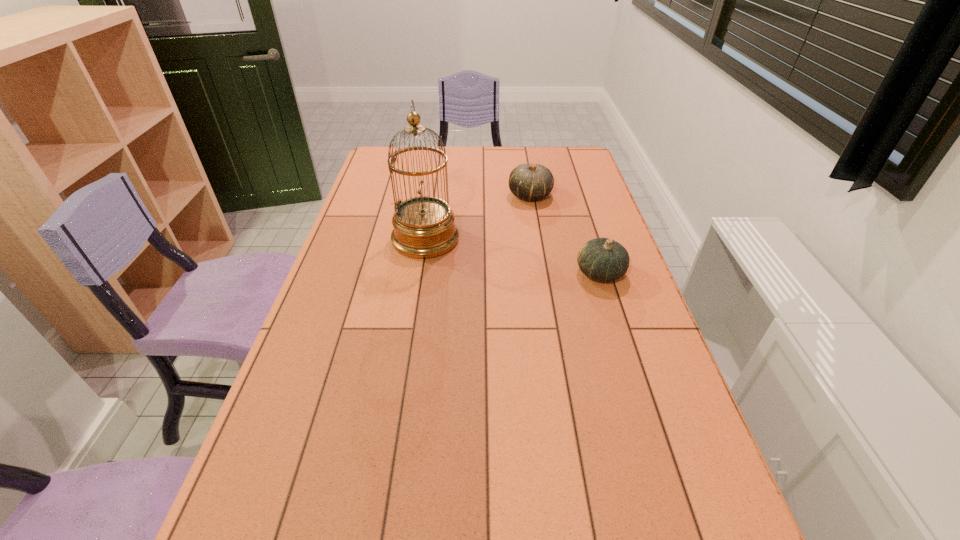
Locate an element on the screen. object at the right edge is located at coordinates (602, 259).

What are the coordinates of `free region at the far edge` in the screenshot? It's located at (497, 158).

Locate an element on the screen. The height and width of the screenshot is (540, 960). blank space at the left edge of the desktop is located at coordinates (258, 487).

In the image, there is a desktop. In order to click on vacant space at the right edge in this screenshot , I will do `click(603, 288)`.

Locate an element on the screen. The width and height of the screenshot is (960, 540). free space at the far right corner of the desktop is located at coordinates (566, 170).

Where is `vacant space in between the farther gourd and the rightmost object`? The image size is (960, 540). vacant space in between the farther gourd and the rightmost object is located at coordinates 565,234.

Locate an element on the screen. free space between the left gourd and the tallest object is located at coordinates (478, 217).

This screenshot has height=540, width=960. I want to click on empty space that is in between the second object from left to right and the birdcage, so click(x=478, y=217).

This screenshot has height=540, width=960. Find the location of `empty space that is in between the nearer gourd and the second object from right to left`. empty space that is in between the nearer gourd and the second object from right to left is located at coordinates (565, 234).

What are the coordinates of `free space between the second object from right to left and the nearer gourd` in the screenshot? It's located at (565, 234).